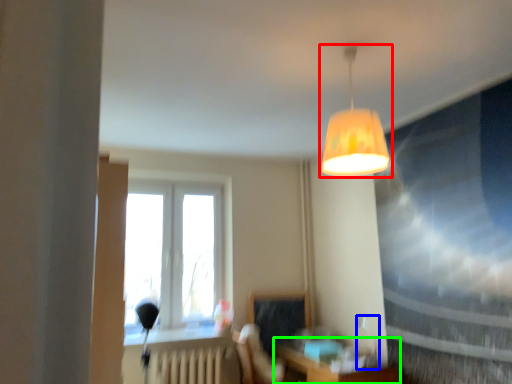
Question: Estimate the real-world distances between objects in this image. Which object is closer to lamp (highlighted by a red box), table lamp (highlighted by a blue box) or table (highlighted by a green box)?

Choices:
 (A) table lamp
 (B) table

Answer: (B)